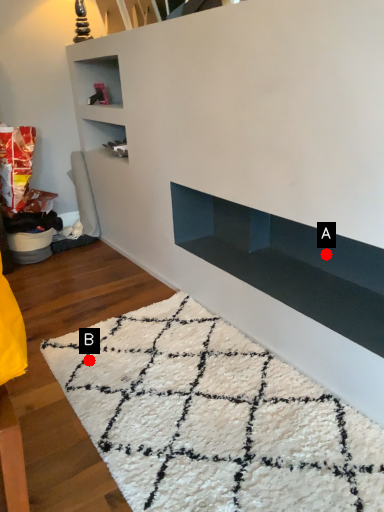
Question: Two points are circled on the image, labeled by A and B beside each circle. Which point is closer to the camera taking this photo?

Choices:
 (A) A is closer
 (B) B is closer

Answer: (B)